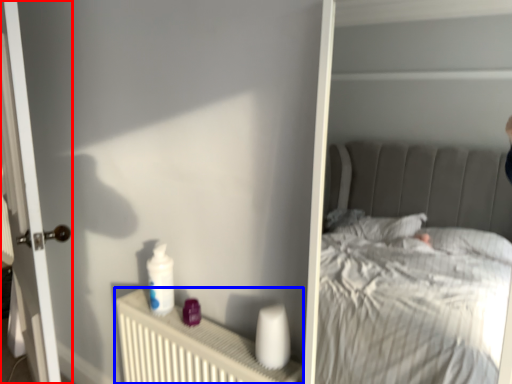
Question: Which of the following is the closest to the observer, door (highlighted by a red box) or radiator (highlighted by a blue box)?

Choices:
 (A) door
 (B) radiator

Answer: (B)